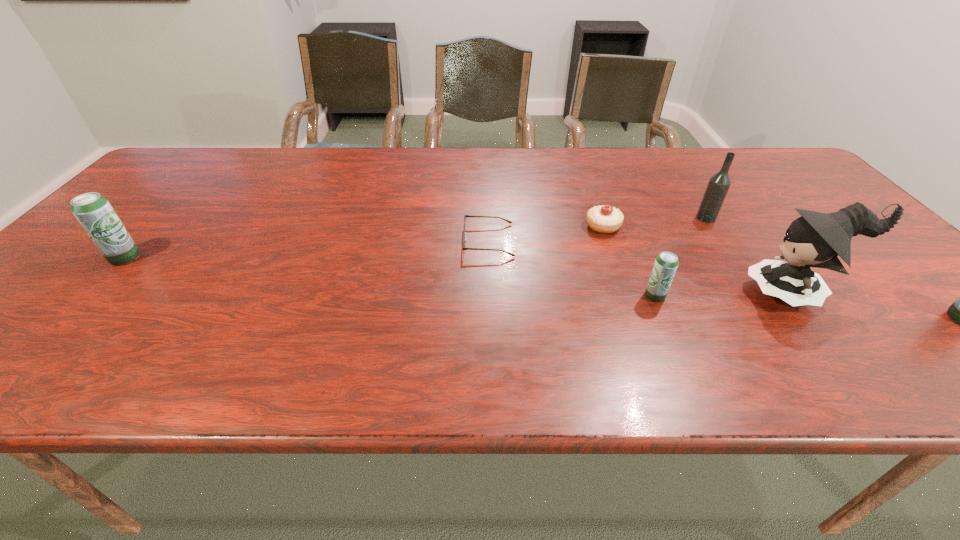
Identify the location of the farthest beer can. (93, 211).

At what (x,y) coordinates should I click in order to perform the action: click on the leftmost beer can. Please return your answer as a coordinate pair (x, y). Looking at the image, I should click on (93, 211).

At what (x,y) coordinates should I click in order to perform the action: click on the fifth tallest object. Please return your answer as a coordinate pair (x, y). Image resolution: width=960 pixels, height=540 pixels. Looking at the image, I should click on (666, 263).

Where is `the second beer can from right to left`? the second beer can from right to left is located at coordinates (666, 263).

Identify the location of vodka. The image size is (960, 540). (718, 185).

You are a GUI agent. You are given a task and a screenshot of the screen. Output one action in this format:
    pyautogui.click(x=<x>, y=<y>)
    Task: Click on the second shortest object
    The width and height of the screenshot is (960, 540).
    Given the screenshot: What is the action you would take?
    click(605, 219)

At what (x,y) coordinates should I click in order to perform the action: click on the shortest object. Please return your answer as a coordinate pair (x, y). Looking at the image, I should click on (464, 237).

Locate an element on the screen. Image resolution: width=960 pixels, height=540 pixels. spectacles is located at coordinates (464, 237).

You are a GUI agent. You are given a task and a screenshot of the screen. Output one action in this format:
    pyautogui.click(x=<x>, y=<y>)
    Task: Click on the doll
    The height and width of the screenshot is (540, 960).
    Given the screenshot: What is the action you would take?
    pyautogui.click(x=815, y=239)

Where is `free space located on the right of the leftmost object`? free space located on the right of the leftmost object is located at coordinates (305, 258).